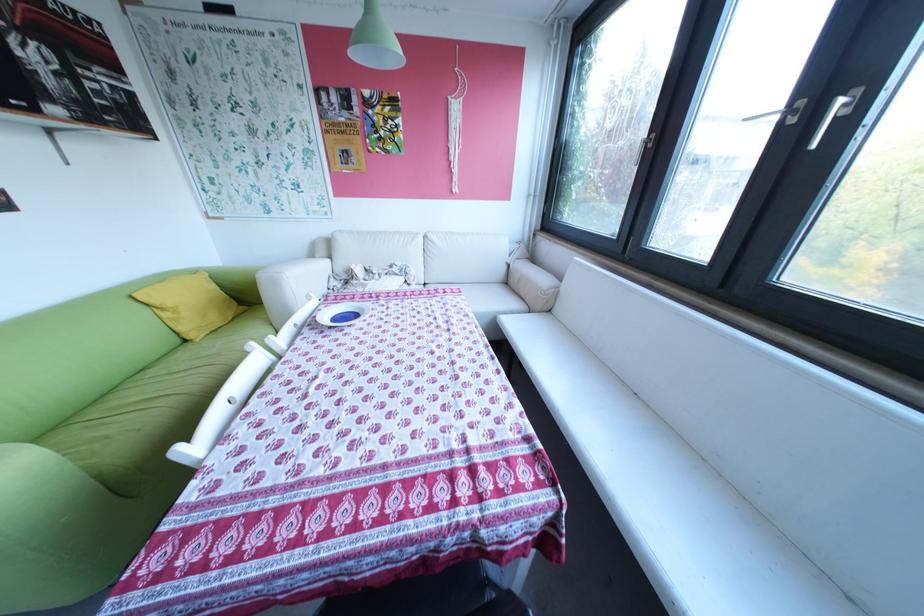
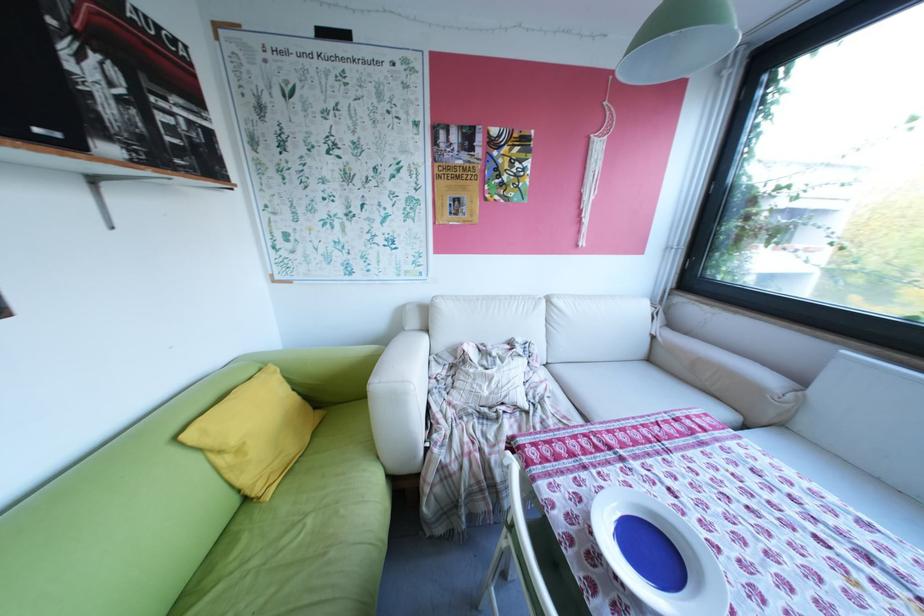
In a continuous first-person perspective shot, in which direction is the camera moving?

The movement direction of the cameraman is left, forward.